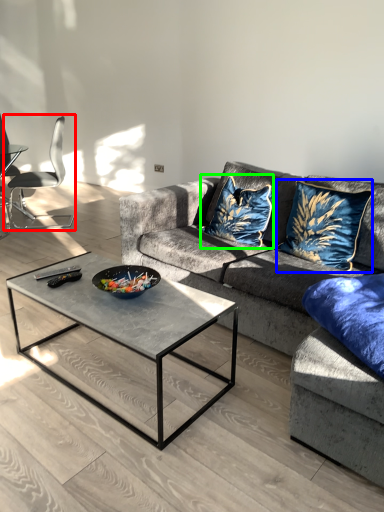
Question: Based on their relative distances, which object is farther from chair (highlighted by a red box)? Choose from throw pillow (highlighted by a blue box) and throw pillow (highlighted by a green box).

Choices:
 (A) throw pillow
 (B) throw pillow

Answer: (A)